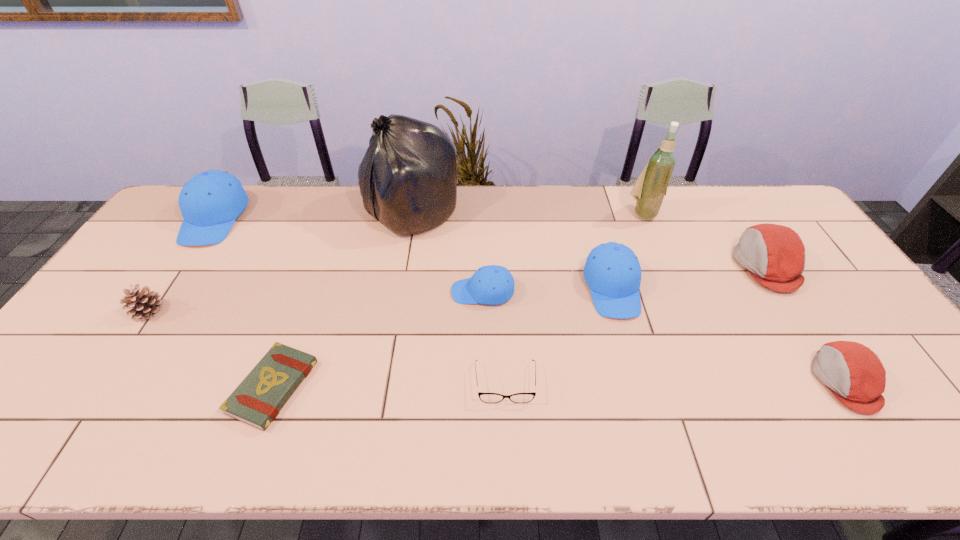
Find the location of a particular element. plastic bag is located at coordinates (407, 178).

Find the location of a particular element. This screenshot has width=960, height=540. the third object from right to left is located at coordinates (649, 191).

At what (x,y) coordinates should I click in order to perform the action: click on the biggest blue cap. Please return your answer as a coordinate pair (x, y). The width and height of the screenshot is (960, 540). Looking at the image, I should click on (210, 201).

The height and width of the screenshot is (540, 960). Identify the location of the eighth shortest object. (210, 201).

You are a GUI agent. You are given a task and a screenshot of the screen. Output one action in this format:
    pyautogui.click(x=<x>, y=<y>)
    Task: Click on the rightmost blue cap
    Image resolution: width=960 pixels, height=540 pixels.
    Given the screenshot: What is the action you would take?
    pyautogui.click(x=612, y=271)

The image size is (960, 540). Identify the location of the fourth object from right to left. [x=612, y=271].

Where is `the bigger red cap`? Image resolution: width=960 pixels, height=540 pixels. the bigger red cap is located at coordinates (774, 255).

Identify the location of pinecone. (144, 304).

The width and height of the screenshot is (960, 540). I want to click on the second blue cap from left to right, so click(490, 285).

Locate an element on the screen. The image size is (960, 540). the fourth cap from right to left is located at coordinates (490, 285).